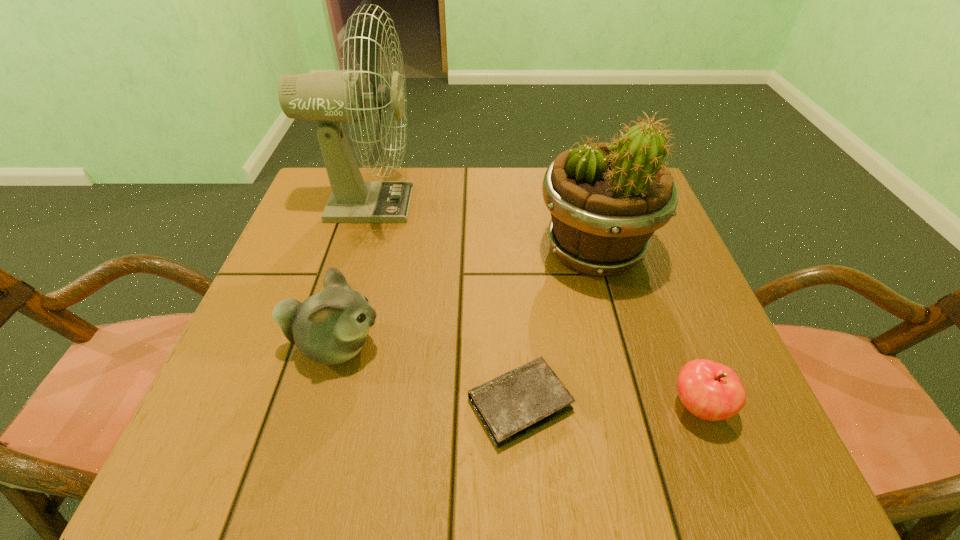
Find the location of `object that is at the near right corner`. object that is at the near right corner is located at coordinates point(711,391).

Where is `free location at the far edge of the desktop`? free location at the far edge of the desktop is located at coordinates (548, 222).

Where is `free region at the near edge of the desktop`? free region at the near edge of the desktop is located at coordinates (376, 420).

I want to click on free region at the left edge, so click(x=282, y=280).

Locate an element on the screen. This screenshot has width=960, height=540. vacant space at the right edge of the desktop is located at coordinates (729, 356).

Locate an element on the screen. vacant area at the far left corner of the desktop is located at coordinates (324, 194).

This screenshot has height=540, width=960. What are the coordinates of `free space at the near left corner of the desktop` in the screenshot? It's located at (252, 441).

Find the location of a particular element. vacant space at the near right corner is located at coordinates (780, 463).

The image size is (960, 540). I want to click on empty location between the flowerpot and the apple, so click(646, 329).

The image size is (960, 540). What are the coordinates of `vacant region between the hamster and the flowerpot` in the screenshot? It's located at (465, 299).